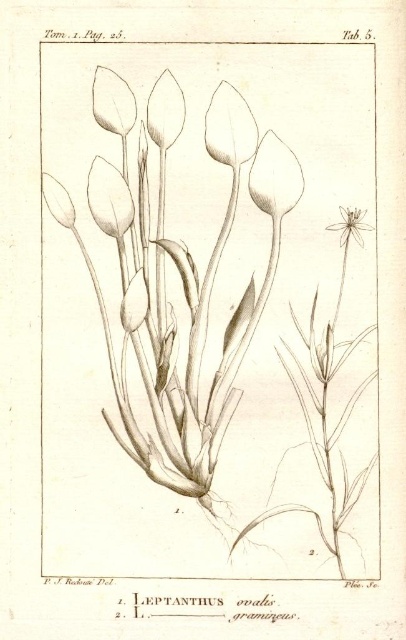
Which is behind, point (267, 172) or point (123, 106)?

The point (267, 172) is behind.

Which is more to the right, matte white petal at center or matte white petal at upper left?

From the viewer's perspective, matte white petal at center appears more on the right side.

This screenshot has height=640, width=406. I want to click on matte white petal at center, so click(x=274, y=177).